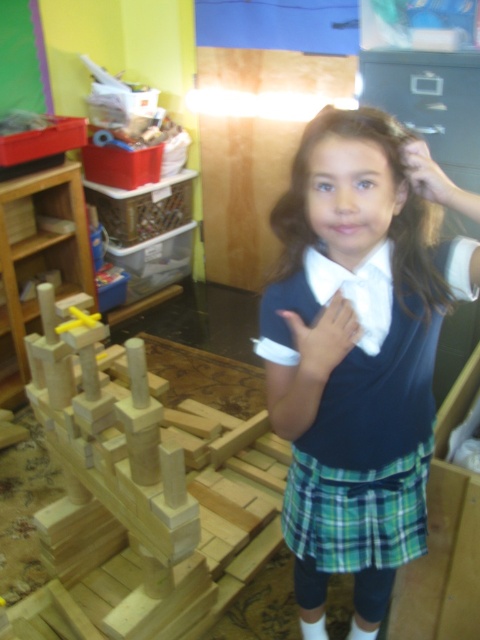
The girl is holding a small toy in her right hand and a pencil in her left. She wants to place both items on the matte blue sweater at center. If the toy is 3 inches long and the pencil is 6 inches long, will both items fit side by side on the sweater without overlapping?

The items are 35.51 inches apart, so yes, both the toy and pencil can fit side by side on the matte blue sweater at center since their combined length is 9 inches, which is less than the available space.

The young girl is holding an object that is 10 cm in length. She wants to place it between the natural wood blocks at left and the brown silky hair at center. Will the object fit between them?

The natural wood blocks at left are larger than the brown silky hair at center. Since the object is 10 cm long, it may fit depending on the distance between them, but the description does not provide exact measurements of the space between the objects. Therefore, it is uncertain if the object will fit.